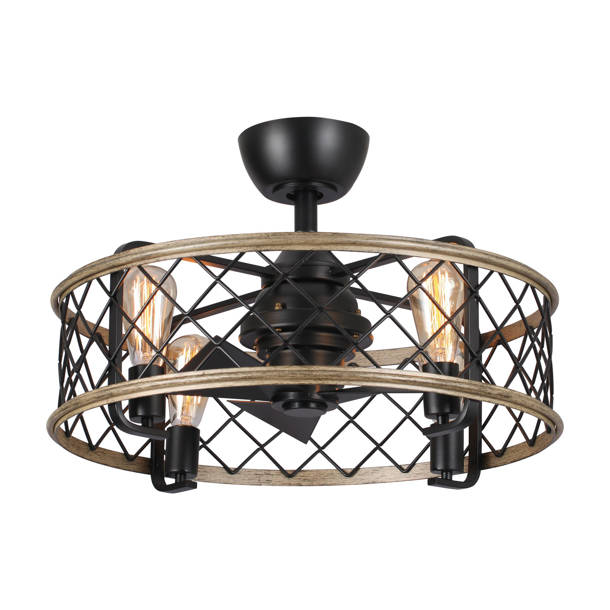
This screenshot has height=610, width=610. Find the location of `light on the left side`. light on the left side is located at coordinates (159, 306), (179, 351).